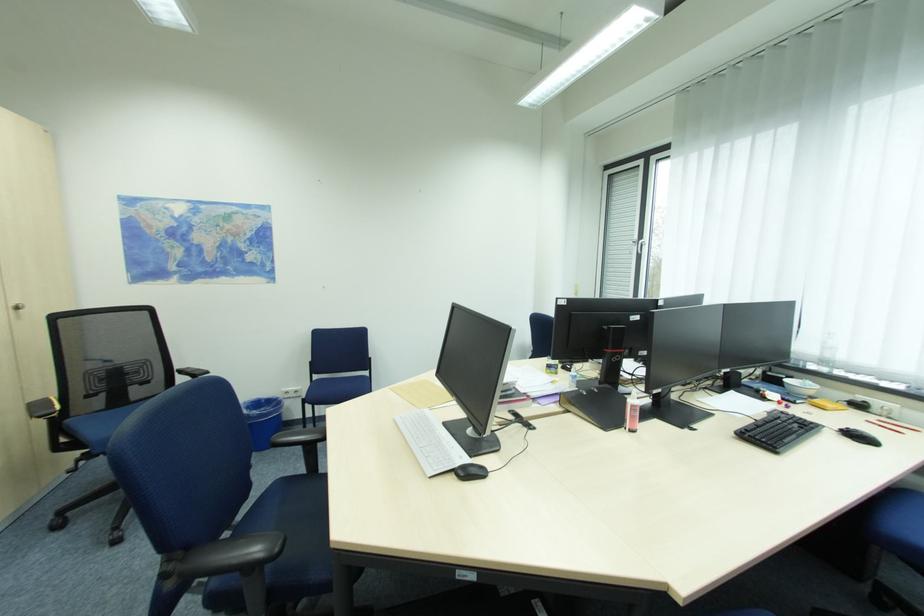
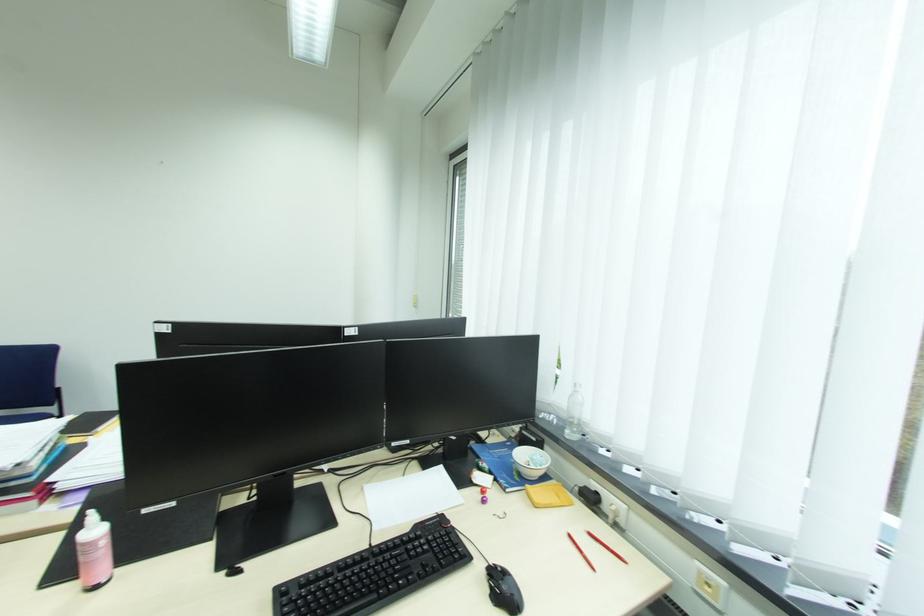
In a continuous first-person perspective shot, in which direction is the camera moving?

The cameraman moved toward right, forward.